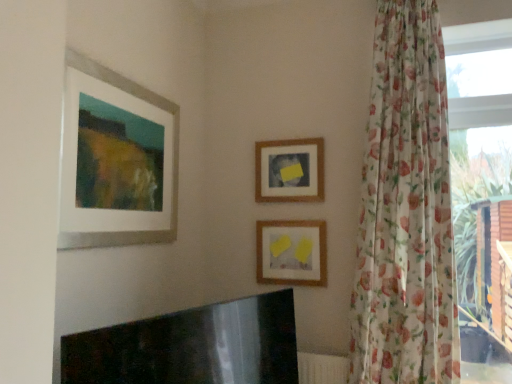
This screenshot has width=512, height=384. Identify the location of wooden frame at center, arranged as the third picture frame when viewed from the front. (290, 170).

How much space does wooden frame at center, which appears as the 2th picture frame when viewed from the left, occupy horizontally?

wooden frame at center, which appears as the 2th picture frame when viewed from the left, is 1.33 inches wide.

At what (x,y) coordinates should I click in order to perform the action: click on matte white picture frame at upper left, the first picture frame from the left. Please return your answer as a coordinate pair (x, y). Looking at the image, I should click on (172, 162).

From a real-world perspective, starting from the wooden frame at center, which appears as the 2th picture frame when viewed from the left, which picture frame is the 1st one below it? Please provide its 2D coordinates.

[(172, 162)]

Between wooden frame at center, marked as the first picture frame in a back-to-front arrangement, and matte white picture frame at upper left, the 3th picture frame viewed from the back, which one is positioned behind?

wooden frame at center, marked as the first picture frame in a back-to-front arrangement, is further from the camera.

Considering the points (278, 151) and (170, 109), which point is behind, point (278, 151) or point (170, 109)?

The point (278, 151) is more distant.

Considering the sizes of objects wooden frame at center, arranged as the third picture frame when viewed from the front, and matte white picture frame at upper left, which appears as the third picture frame when viewed from the right, in the image provided, who is taller, wooden frame at center, arranged as the third picture frame when viewed from the front, or matte white picture frame at upper left, which appears as the third picture frame when viewed from the right,?

matte white picture frame at upper left, which appears as the third picture frame when viewed from the right, is taller.

Is matte white picture frame at upper left, the first picture frame in the front-to-back sequence, facing away from matte paper picture frame at center, marked as the 2th picture frame in a front-to-back arrangement?

No, matte white picture frame at upper left, the first picture frame in the front-to-back sequence, is not facing the opposite direction of matte paper picture frame at center, marked as the 2th picture frame in a front-to-back arrangement.

Starting from the matte white picture frame at upper left, which appears as the third picture frame when viewed from the right, which picture frame is the 2nd one to the right? Please provide its 2D coordinates.

[(292, 253)]

Looking at the image, does matte white picture frame at upper left, the first picture frame in the front-to-back sequence, seem bigger or smaller compared to matte paper picture frame at center, the third picture frame positioned from the left?

Considering their sizes, matte white picture frame at upper left, the first picture frame in the front-to-back sequence, takes up more space than matte paper picture frame at center, the third picture frame positioned from the left.

Does point (138, 237) come farther from viewer compared to point (264, 274)?

No, it is in front of (264, 274).

Are matte paper picture frame at center, the third picture frame positioned from the left, and wooden frame at center, the second picture frame from the right, beside each other?

They are not placed beside each other.

From the image's perspective, which is above, matte paper picture frame at center, the third picture frame positioned from the left, or wooden frame at center, arranged as the third picture frame when viewed from the front?

wooden frame at center, arranged as the third picture frame when viewed from the front, is shown above in the image.

Is matte paper picture frame at center, the third picture frame positioned from the left, facing away from wooden frame at center, arranged as the third picture frame when viewed from the front?

No, matte paper picture frame at center, the third picture frame positioned from the left, is not facing the opposite direction of wooden frame at center, arranged as the third picture frame when viewed from the front.

From the picture: Is the position of matte paper picture frame at center, marked as the 2th picture frame in a front-to-back arrangement, more distant than that of wooden frame at center, arranged as the third picture frame when viewed from the front?

That is False.

In the image, is matte paper picture frame at center, marked as the second picture frame in a back-to-front arrangement, positioned in front of or behind transparent floral curtain at right?

Visually, matte paper picture frame at center, marked as the second picture frame in a back-to-front arrangement, is located behind transparent floral curtain at right.

Considering the relative positions of matte paper picture frame at center, the third picture frame positioned from the left, and transparent floral curtain at right in the image provided, is matte paper picture frame at center, the third picture frame positioned from the left, to the left or to the right of transparent floral curtain at right?

From the image, it's evident that matte paper picture frame at center, the third picture frame positioned from the left, is to the left of transparent floral curtain at right.

Consider the image. From a real-world perspective, does matte paper picture frame at center, marked as the 2th picture frame in a front-to-back arrangement, sit lower than transparent floral curtain at right?

Indeed, from a real-world perspective, matte paper picture frame at center, marked as the 2th picture frame in a front-to-back arrangement, is positioned beneath transparent floral curtain at right.

From the image's perspective, which is above, matte paper picture frame at center, marked as the second picture frame in a back-to-front arrangement, or transparent floral curtain at right?

transparent floral curtain at right is shown above in the image.

Consider the image. Which of these two, transparent floral curtain at right or matte white picture frame at upper left, the first picture frame from the left, stands shorter?

Standing shorter between the two is matte white picture frame at upper left, the first picture frame from the left.

Find the location of a particular element. This screenshot has width=512, height=384. picture frame that is the 2nd one when counting upward from the transparent floral curtain at right (from the image's perspective) is located at coordinates (172, 162).

Consider the image. From a real-world perspective, does transparent floral curtain at right stand above matte white picture frame at upper left, the first picture frame from the left?

No, from a real-world perspective, transparent floral curtain at right is not above matte white picture frame at upper left, the first picture frame from the left.

Can you tell me how much transparent floral curtain at right and floral sheer curtain at right differ in facing direction?

transparent floral curtain at right and floral sheer curtain at right are facing 0.343 degrees away from each other.

Considering the relative positions of transparent floral curtain at right and floral sheer curtain at right in the image provided, is transparent floral curtain at right to the right of floral sheer curtain at right from the viewer's perspective?

Yes, transparent floral curtain at right is to the right of floral sheer curtain at right.

Is point (488, 219) positioned behind point (375, 225)?

No, (488, 219) is closer to viewer.

Is transparent floral curtain at right turned away from floral sheer curtain at right?

No, transparent floral curtain at right's orientation is not away from floral sheer curtain at right.

In the scene shown: Is wooden frame at center, marked as the first picture frame in a back-to-front arrangement, spatially inside matte paper picture frame at center, the third picture frame positioned from the left, or outside of it?

wooden frame at center, marked as the first picture frame in a back-to-front arrangement, is located beyond the bounds of matte paper picture frame at center, the third picture frame positioned from the left.

Are wooden frame at center, which appears as the 2th picture frame when viewed from the left, and matte paper picture frame at center, marked as the second picture frame in a back-to-front arrangement, beside each other?

No.

Considering the sizes of objects wooden frame at center, marked as the first picture frame in a back-to-front arrangement, and matte paper picture frame at center, the third picture frame positioned from the left, in the image provided, who is taller, wooden frame at center, marked as the first picture frame in a back-to-front arrangement, or matte paper picture frame at center, the third picture frame positioned from the left,?

With more height is wooden frame at center, marked as the first picture frame in a back-to-front arrangement.

The height and width of the screenshot is (384, 512). In order to click on the 1st picture frame positioned below the matte white picture frame at upper left, which appears as the third picture frame when viewed from the right (from the image's perspective) in this screenshot , I will do `click(290, 170)`.

This screenshot has width=512, height=384. Identify the location of the 1st picture frame directly above the matte paper picture frame at center, marked as the 2th picture frame in a front-to-back arrangement (from a real-world perspective). (172, 162).

Looking at the image, which one is located further to matte paper picture frame at center, positioned as the first picture frame in right-to-left order, transparent floral curtain at right or matte white picture frame at upper left, the first picture frame from the left?

transparent floral curtain at right.

Considering their positions, is transparent floral curtain at right positioned further to floral sheer curtain at right than wooden frame at center, which appears as the 2th picture frame when viewed from the left?

wooden frame at center, which appears as the 2th picture frame when viewed from the left.

Which object lies further to the anchor point transparent floral curtain at right, wooden frame at center, the second picture frame from the right, or matte white picture frame at upper left, the first picture frame from the left?

Among the two, matte white picture frame at upper left, the first picture frame from the left, is located further to transparent floral curtain at right.

Looking at the image, which one is located further to wooden frame at center, the second picture frame from the right, matte paper picture frame at center, marked as the 2th picture frame in a front-to-back arrangement, or transparent floral curtain at right?

The object further to wooden frame at center, the second picture frame from the right, is transparent floral curtain at right.

When comparing their distances from wooden frame at center, which appears as the 2th picture frame when viewed from the left, does matte paper picture frame at center, marked as the second picture frame in a back-to-front arrangement, or matte white picture frame at upper left, the 3th picture frame viewed from the back, seem closer?

Based on the image, matte paper picture frame at center, marked as the second picture frame in a back-to-front arrangement, appears to be nearer to wooden frame at center, which appears as the 2th picture frame when viewed from the left.

Considering their positions, is transparent floral curtain at right positioned further to matte white picture frame at upper left, the first picture frame in the front-to-back sequence, than wooden frame at center, the second picture frame from the right?

Among the two, transparent floral curtain at right is located further to matte white picture frame at upper left, the first picture frame in the front-to-back sequence.

When comparing their distances from floral sheer curtain at right, does transparent floral curtain at right or matte white picture frame at upper left, the first picture frame in the front-to-back sequence, seem further?

matte white picture frame at upper left, the first picture frame in the front-to-back sequence, is further to floral sheer curtain at right.

Considering their positions, is wooden frame at center, marked as the first picture frame in a back-to-front arrangement, positioned closer to floral sheer curtain at right than transparent floral curtain at right?

Among the two, transparent floral curtain at right is located nearer to floral sheer curtain at right.

This screenshot has height=384, width=512. I want to click on curtain between matte white picture frame at upper left, the first picture frame from the left, and transparent floral curtain at right, so click(406, 210).

Locate an element on the screen. This screenshot has width=512, height=384. picture frame between floral sheer curtain at right and wooden frame at center, arranged as the third picture frame when viewed from the front, in the front-back direction is located at coordinates (292, 253).

This screenshot has width=512, height=384. I want to click on picture frame positioned between matte white picture frame at upper left, the 3th picture frame viewed from the back, and wooden frame at center, marked as the first picture frame in a back-to-front arrangement, from near to far, so click(x=292, y=253).

At what (x,y) coordinates should I click in order to perform the action: click on curtain between matte paper picture frame at center, positioned as the first picture frame in right-to-left order, and transparent floral curtain at right from left to right. Please return your answer as a coordinate pair (x, y). Image resolution: width=512 pixels, height=384 pixels. Looking at the image, I should click on (406, 210).